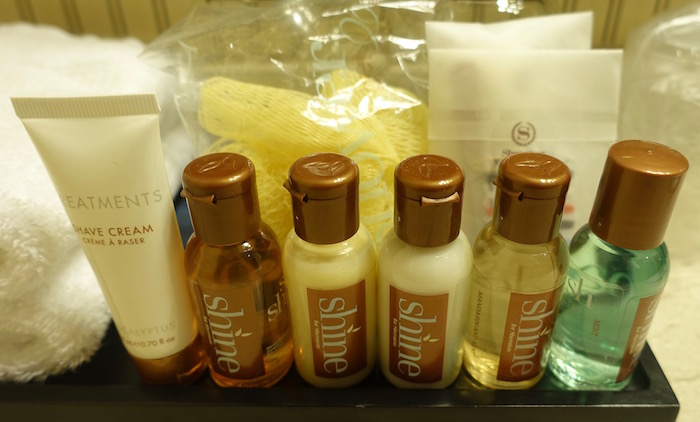
Find the location of a particular element. This screenshot has height=422, width=700. counter is located at coordinates (680, 330).